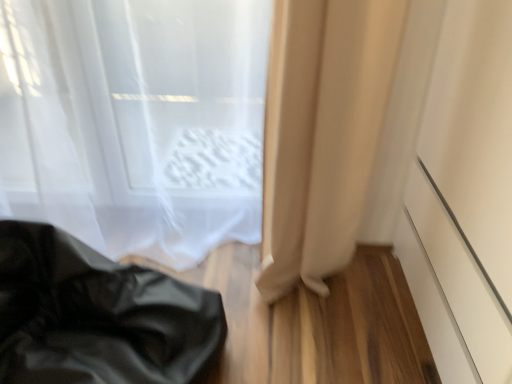
Locate an element on the screen. space that is in front of beige fabric curtain at lower right, positioned as the 1th curtain in right-to-left order is located at coordinates (330, 340).